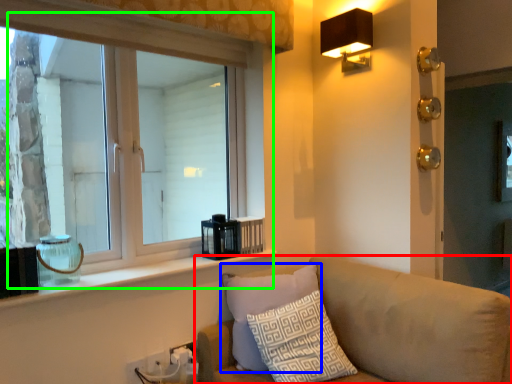
Question: Which is farther away from studio couch (highlighted by a red box)? pillow (highlighted by a blue box) or window (highlighted by a green box)?

Choices:
 (A) pillow
 (B) window

Answer: (B)